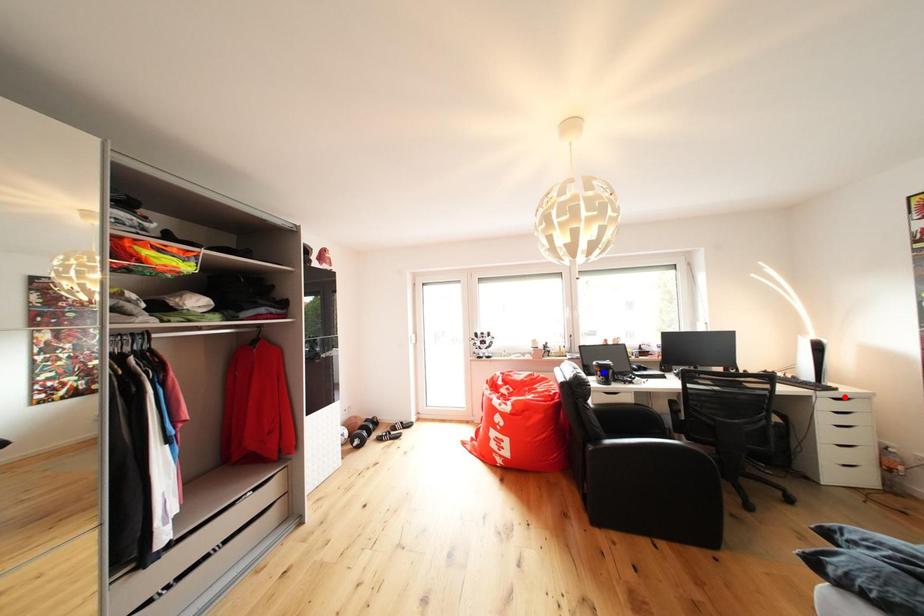
Question: Two points are marked on the image. Which point is closer to the camera?

Choices:
 (A) Blue point is closer.
 (B) Red point is closer.

Answer: (B)